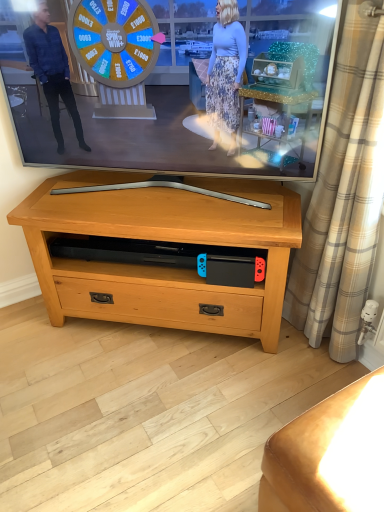
The width and height of the screenshot is (384, 512). In order to click on vacant area situated below matte black tv at center (from a real-world perspective) in this screenshot , I will do `click(167, 185)`.